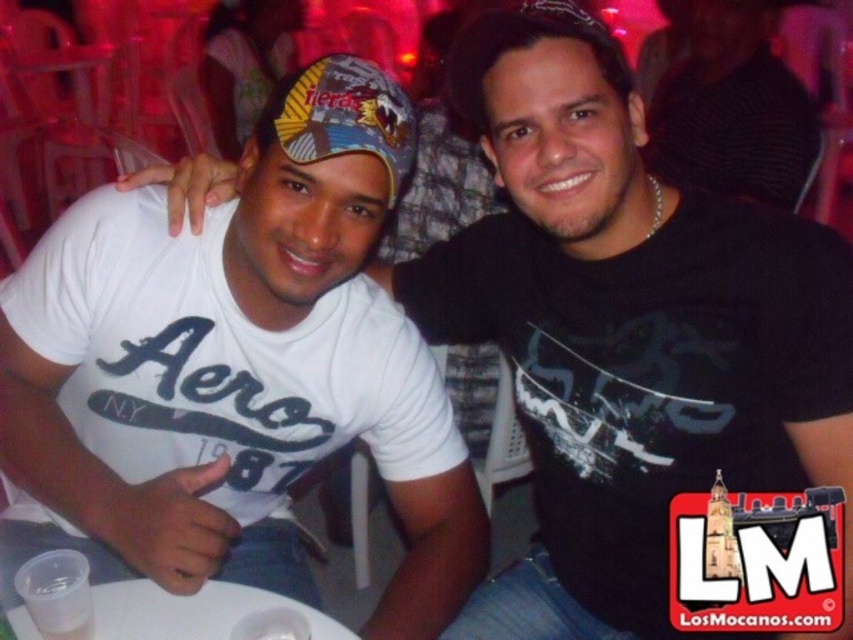
You are at a social gathering with plastic chairs and tables. You see a multicolored fabric baseball cap at center. Where exactly is it located?

The multicolored fabric baseball cap at center is located at point (347, 116).